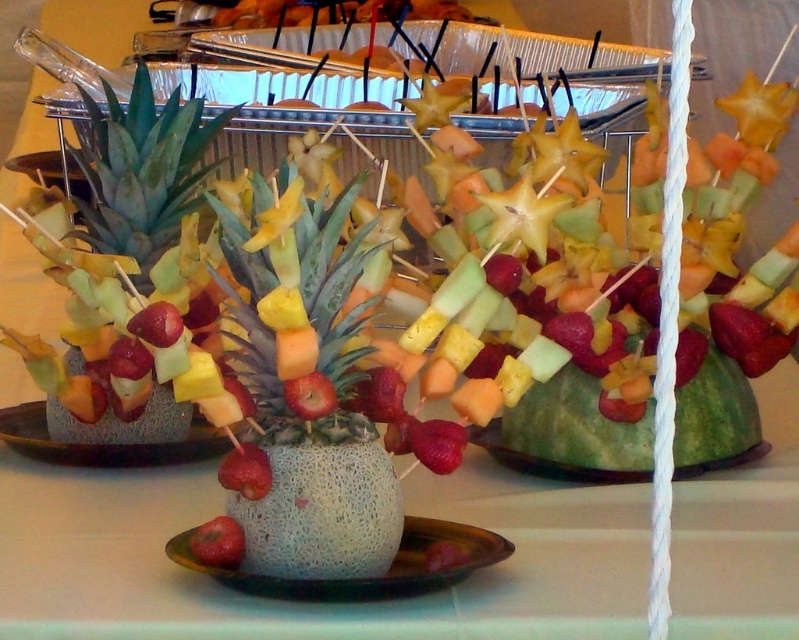
You are at the point marked by the coordinate point (305,388) in the fruit display. What fruit are you standing on?

You are standing on the green textured pineapple at center, as the point (305,388) represents this fruit.

You are setting up a buffet table and need to place a decorative item on the speckled melon plate at center. However, there is a green melon at center nearby. Which melon should you place the item on to ensure it stays visible?

The speckled melon plate at center is located above the green melon at center, so placing the decorative item on the speckled melon plate at center will ensure it stays visible.

Consider the image. You are setting up a fruit display and need to ensure there is enough space between the speckled melon plate at center and the green melon at center for a decorative ribbon. The ribbon requires a minimum of 12 inches of space. Based on the image, is the current distance sufficient?

The distance between the speckled melon plate at center and green melon at center is 11.54 inches, which is slightly less than the required 12 inches. Therefore, the current spacing is insufficient for the decorative ribbon.